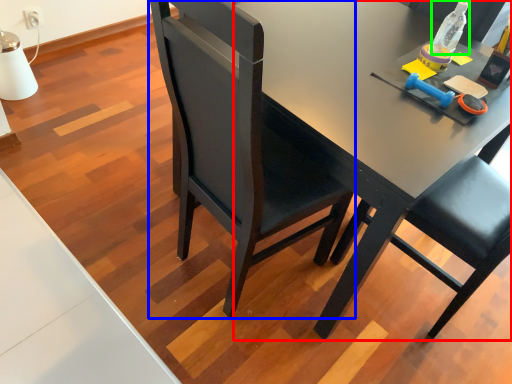
Question: Considering the real-world distances, which object is farthest from desk (highlighted by a red box)? chair (highlighted by a blue box) or bottle (highlighted by a green box)?

Choices:
 (A) chair
 (B) bottle

Answer: (B)